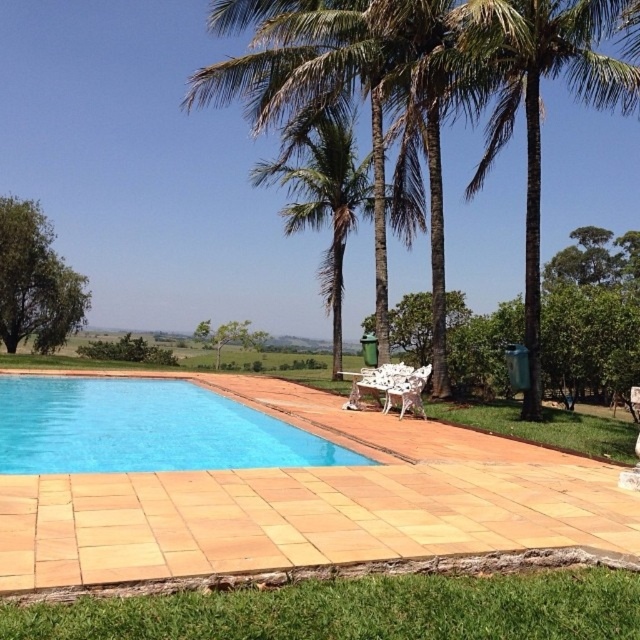
You are a maintenance worker needing to reach the blue smooth pool at lower left from the green leafy tree at left. Can you walk directly to it without any obstacles?

The distance between the blue smooth pool at lower left and the green leafy tree at left is 12.87 meters. Since there are no mentioned obstacles in the scene description, you can walk directly to the pool.

You are standing at the edge of the swimming pool and want to place a small bench exactly at point (323, 196). What will the bench be placed next to?

The bench will be placed next to the green leafy palm tree at center located at point (323, 196).